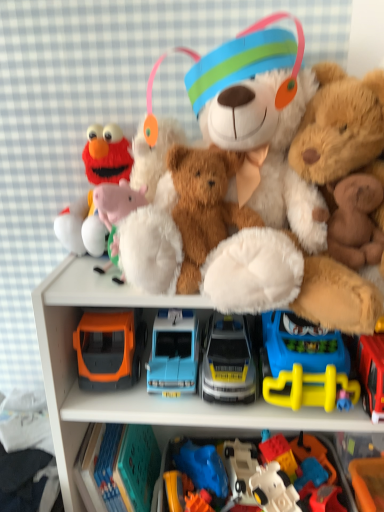
Question: From a real-world perspective, does yellow plastic toy at lower right, the 3th toy viewed from the right, sit lower than white plush toy at upper left, which is the 9th toy from right to left?

Choices:
 (A) no
 (B) yes

Answer: (B)

Question: From the image's perspective, is yellow plastic toy at lower right, which ranks as the 9th toy in left-to-right order, under white plush toy at upper left, which is the third toy in left-to-right order?

Choices:
 (A) no
 (B) yes

Answer: (B)

Question: Is yellow plastic toy at lower right, which ranks as the 9th toy in left-to-right order, facing away from white plush toy at upper left, which is the third toy in left-to-right order?

Choices:
 (A) yes
 (B) no

Answer: (B)

Question: Considering the relative positions of yellow plastic toy at lower right, which ranks as the 9th toy in left-to-right order, and white plush toy at upper left, which is the third toy in left-to-right order, in the image provided, is yellow plastic toy at lower right, which ranks as the 9th toy in left-to-right order, in front of white plush toy at upper left, which is the third toy in left-to-right order,?

Choices:
 (A) no
 (B) yes

Answer: (A)

Question: Considering the relative sizes of yellow plastic toy at lower right, the 3th toy viewed from the right, and white plush toy at upper left, which is the 9th toy from right to left, in the image provided, is yellow plastic toy at lower right, the 3th toy viewed from the right, smaller than white plush toy at upper left, which is the 9th toy from right to left,?

Choices:
 (A) yes
 (B) no

Answer: (B)

Question: Is yellow plastic toy at lower right, the 3th toy viewed from the right, positioned far away from white plush toy at upper left, which is the third toy in left-to-right order?

Choices:
 (A) no
 (B) yes

Answer: (A)

Question: From the image's perspective, is white plastic robot at lower center, which appears as the 7th toy when viewed from the left, located beneath blue plastic car at center, acting as the 4th toy starting from the left?

Choices:
 (A) no
 (B) yes

Answer: (B)

Question: Does white plastic robot at lower center, marked as the 5th toy in a right-to-left arrangement, have a lesser height compared to blue plastic car at center, the eighth toy when ordered from right to left?

Choices:
 (A) yes
 (B) no

Answer: (B)

Question: Can we say white plastic robot at lower center, which appears as the 7th toy when viewed from the left, lies outside blue plastic car at center, the eighth toy when ordered from right to left?

Choices:
 (A) yes
 (B) no

Answer: (A)

Question: Does white plastic robot at lower center, marked as the 5th toy in a right-to-left arrangement, have a smaller size compared to blue plastic car at center, acting as the 4th toy starting from the left?

Choices:
 (A) no
 (B) yes

Answer: (A)

Question: Does white plastic robot at lower center, which appears as the 7th toy when viewed from the left, have a larger size compared to blue plastic car at center, acting as the 4th toy starting from the left?

Choices:
 (A) yes
 (B) no

Answer: (A)

Question: Does white plastic robot at lower center, marked as the 5th toy in a right-to-left arrangement, touch blue plastic car at center, acting as the 4th toy starting from the left?

Choices:
 (A) yes
 (B) no

Answer: (B)

Question: Can you confirm if metallic silver car at center, the 7th toy viewed from the right, is taller than orange plastic toy car at lower left, which ranks as the tenth toy in right-to-left order?

Choices:
 (A) yes
 (B) no

Answer: (B)